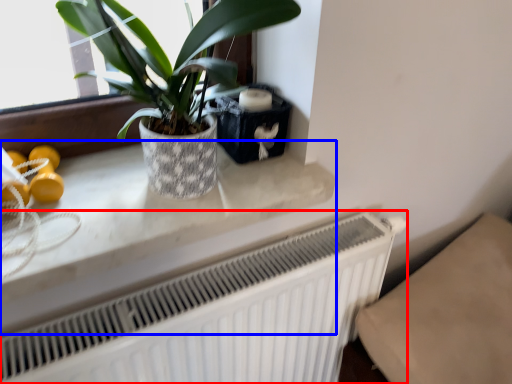
Question: Which object is closer to the camera taking this photo, radiator (highlighted by a red box) or counter top (highlighted by a blue box)?

Choices:
 (A) radiator
 (B) counter top

Answer: (B)